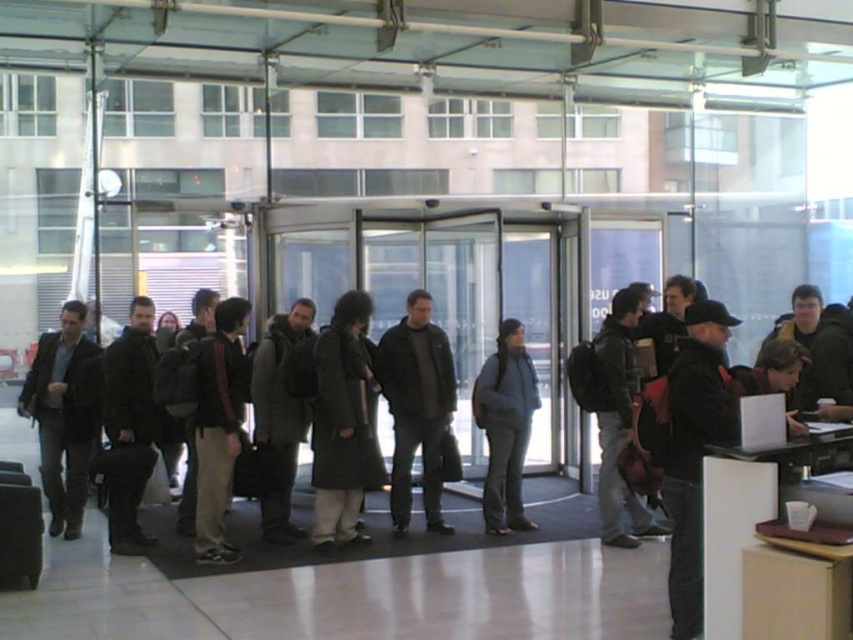
You are an office security guard checking the entrance. You notice two jackets left unattended near the revolving door. The black matte jacket at left and the dark brown leather jacket at center. Which jacket is smaller in size?

The black matte jacket at left is smaller in size than the dark brown leather jacket at center because it occupies less space.

You are a delivery person standing at the entrance of the office building. You need to deliver a package to the person holding the dark gray backpack at center and the dark brown leather jacket at center. However, you can only approach one of them due to the revolving door size. Which person should you approach based on their distance apart?

The dark gray backpack at center and dark brown leather jacket at center are 9.22 feet apart from each other. Since the revolving door size allows approaching only one person, you should approach the one closer to the entrance. However, the description does not specify which is closer, so you might need to check their positions relative to the revolving door.